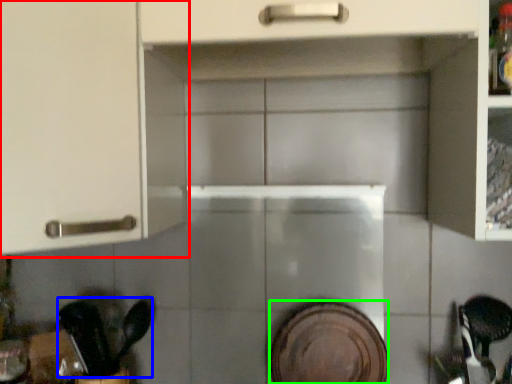
Question: Which object is the closest to the cabinetry (highlighted by a red box)? Choose among these: tableware (highlighted by a blue box) or platter (highlighted by a green box).

Choices:
 (A) tableware
 (B) platter

Answer: (A)